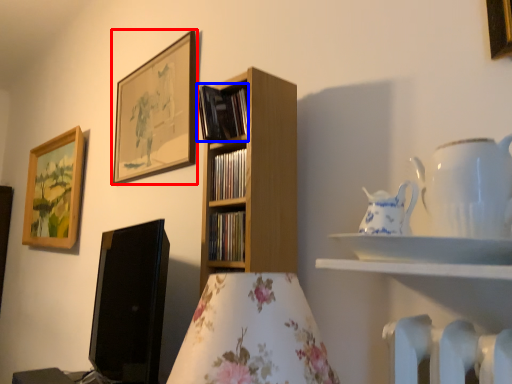
Question: Which object appears farthest to the camera in this image, picture frame (highlighted by a red box) or book (highlighted by a blue box)?

Choices:
 (A) picture frame
 (B) book

Answer: (A)